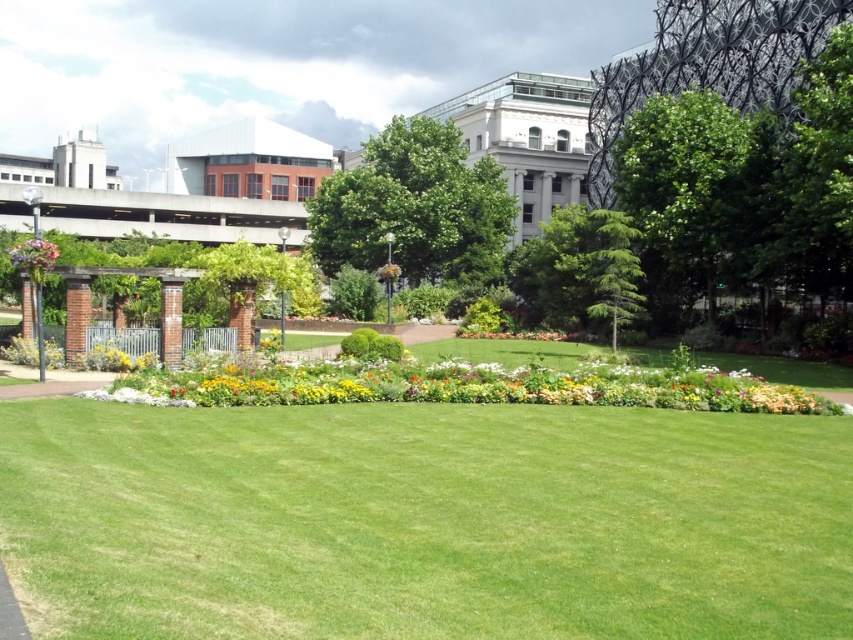
Question: Estimate the real-world distances between objects in this image. Which object is closer to the green leafy tree at right?

Choices:
 (A) pink fabric flower at left
 (B) green leafy tree at center
 (C) green smooth lawn at center

Answer: (B)

Question: Does green smooth lawn at center appear over green leafy tree at center?

Choices:
 (A) yes
 (B) no

Answer: (B)

Question: Does green smooth lawn at center appear over pink fabric flower at left?

Choices:
 (A) no
 (B) yes

Answer: (A)

Question: Based on their relative distances, which object is nearer to the green leafy tree at right?

Choices:
 (A) pink fabric flower at left
 (B) green smooth lawn at center
 (C) green leafy tree at center

Answer: (C)

Question: Observing the image, what is the correct spatial positioning of green leafy tree at right in reference to pink fabric flower at left?

Choices:
 (A) right
 (B) left

Answer: (A)

Question: Estimate the real-world distances between objects in this image. Which object is closer to the green smooth lawn at center?

Choices:
 (A) green leafy tree at center
 (B) pink fabric flower at left

Answer: (B)